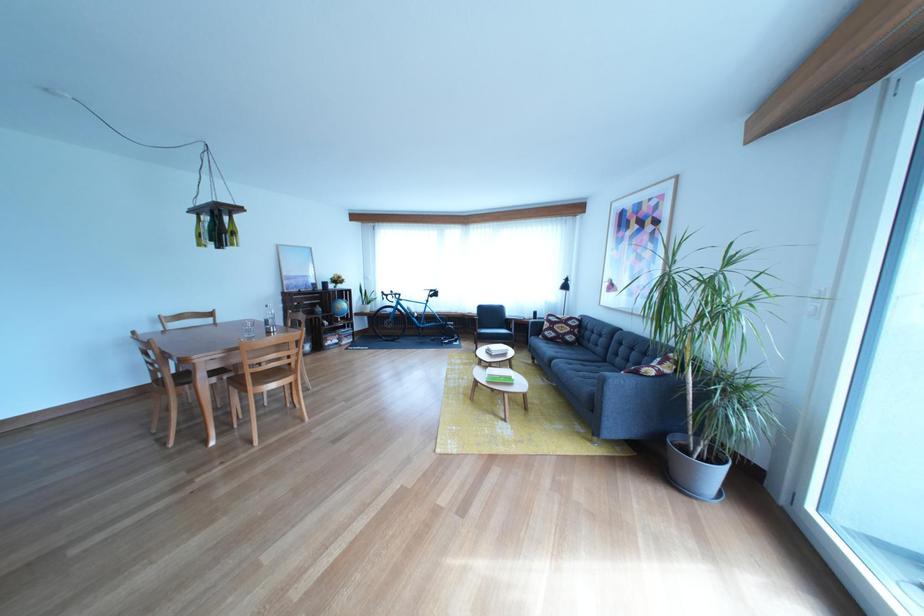
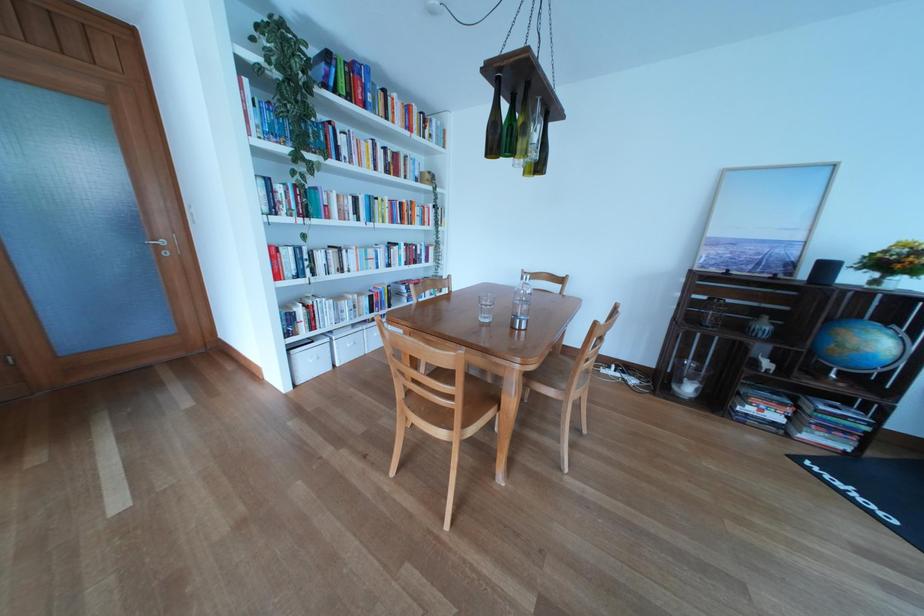
The point at (334, 294) is marked in the first image. Where is the corresponding point in the second image?

(816, 282)